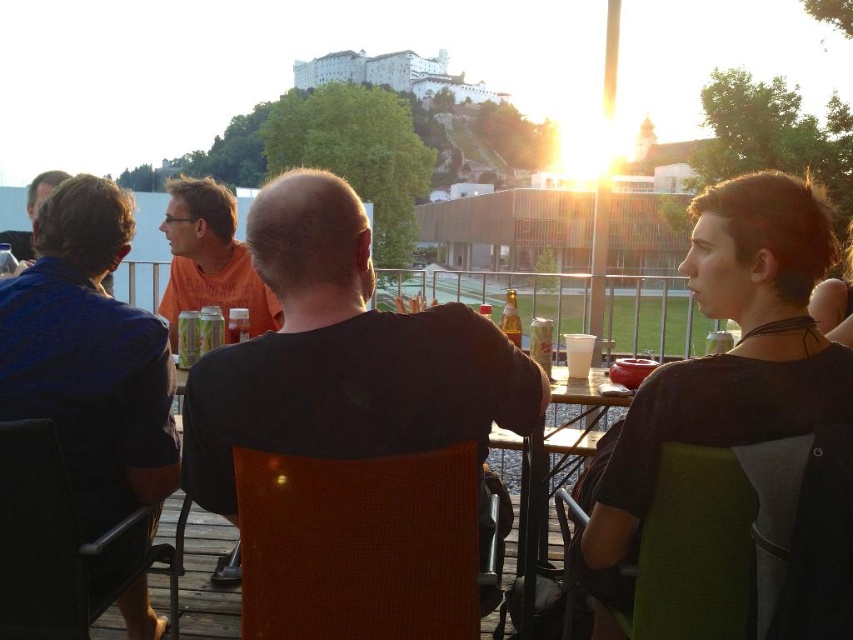
Is dark gray shirt at center bigger than translucent glass beer at table center?

Incorrect, dark gray shirt at center is not larger than translucent glass beer at table center.

Is point (287, 204) in front of point (515, 344)?

Yes, it is in front of point (515, 344).

Which is in front, point (294, 259) or point (518, 344)?

Positioned in front is point (294, 259).

I want to click on dark gray shirt at center, so click(x=344, y=356).

Between point (782, 400) and point (178, 241), which one is positioned in front?

Point (782, 400)

Between black matte shirt at right and orange cotton shirt at center, which one is positioned higher?

orange cotton shirt at center is higher up.

In order to click on black matte shirt at right in this screenshot , I will do `click(732, 348)`.

At what (x,y) coordinates should I click in order to perform the action: click on black matte shirt at right. Please return your answer as a coordinate pair (x, y). Looking at the image, I should click on (732, 348).

Is black matte shirt at right thinner than translucent glass beer at table center?

Yes.

Where is `black matte shirt at right`? black matte shirt at right is located at coordinates (732, 348).

You are a GUI agent. You are given a task and a screenshot of the screen. Output one action in this format:
    pyautogui.click(x=<x>, y=<y>)
    Task: Click on the black matte shirt at right
    The image size is (853, 640).
    Given the screenshot: What is the action you would take?
    pyautogui.click(x=732, y=348)